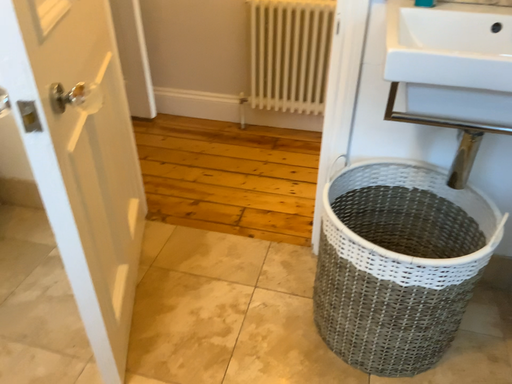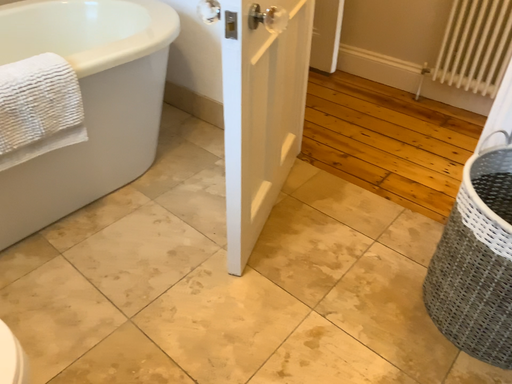
Question: Which way did the camera rotate in the video?

Choices:
 (A) rotated right
 (B) rotated left

Answer: (B)